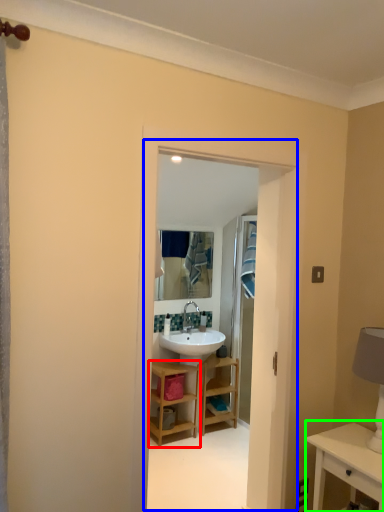
Question: Estimate the real-world distances between objects in this image. Which object is farther from bathroom cabinet (highlighted by a red box), residence (highlighted by a blue box) or table (highlighted by a green box)?

Choices:
 (A) residence
 (B) table

Answer: (B)